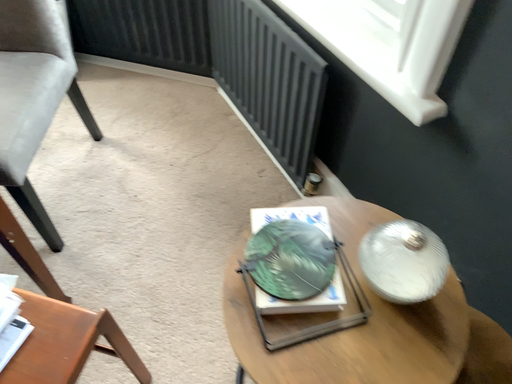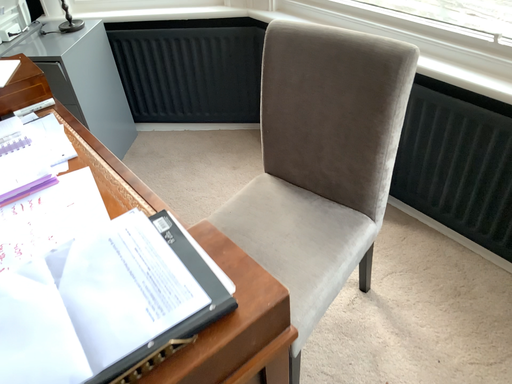
Question: How did the camera likely rotate when shooting the video?

Choices:
 (A) rotated upward
 (B) rotated downward

Answer: (A)